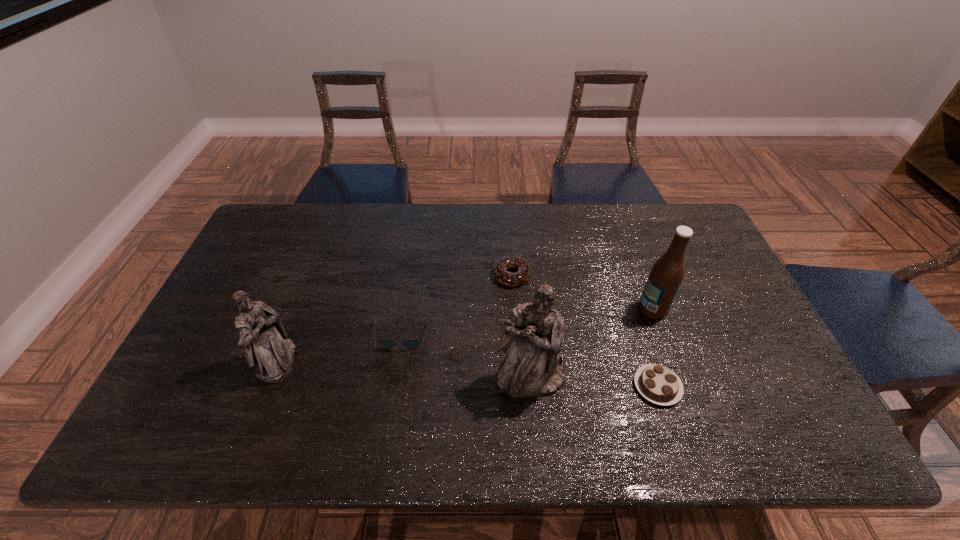
The image size is (960, 540). I want to click on the leftmost object, so pos(262,336).

Identify the location of the left figurine. Image resolution: width=960 pixels, height=540 pixels. (262, 336).

Where is `the taller figurine`? This screenshot has height=540, width=960. the taller figurine is located at coordinates (532, 337).

This screenshot has width=960, height=540. Find the location of `beer bottle`. beer bottle is located at coordinates (666, 276).

Identify the location of the fifth object from right to left. The height and width of the screenshot is (540, 960). (385, 343).

Identify the location of the farthest object. Image resolution: width=960 pixels, height=540 pixels. (507, 278).

Identify the location of chocolate cake. The height and width of the screenshot is (540, 960). (658, 384).

Find the location of a particular element. Image resolution: width=960 pixels, height=540 pixels. free space located on the front-facing side of the third tallest object is located at coordinates (314, 361).

Find the location of a particular element. vacant space situated 0.270m on the left of the beer bottle is located at coordinates (545, 309).

Where is `vacant space located on the lenses of the second object from left to right`? This screenshot has width=960, height=540. vacant space located on the lenses of the second object from left to right is located at coordinates coord(394,394).